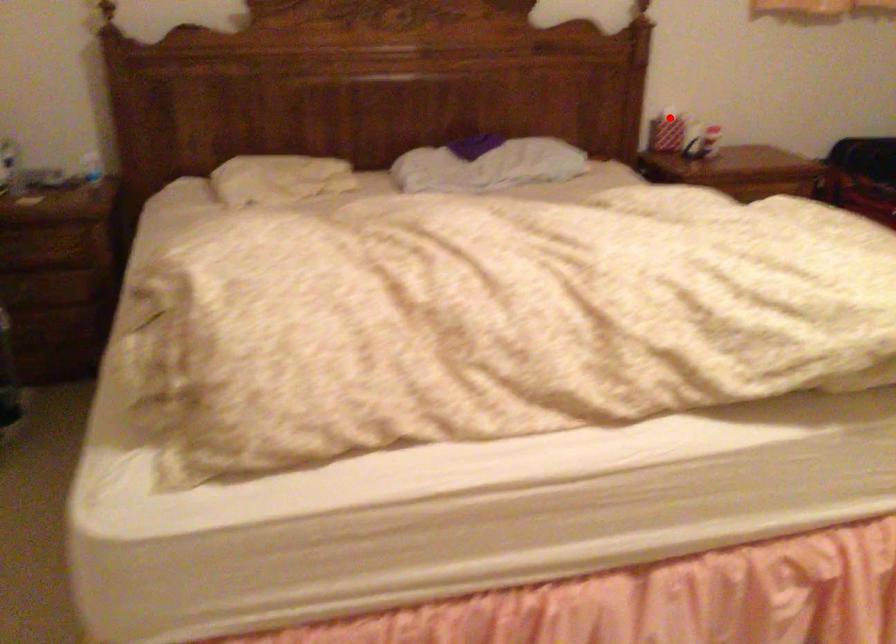
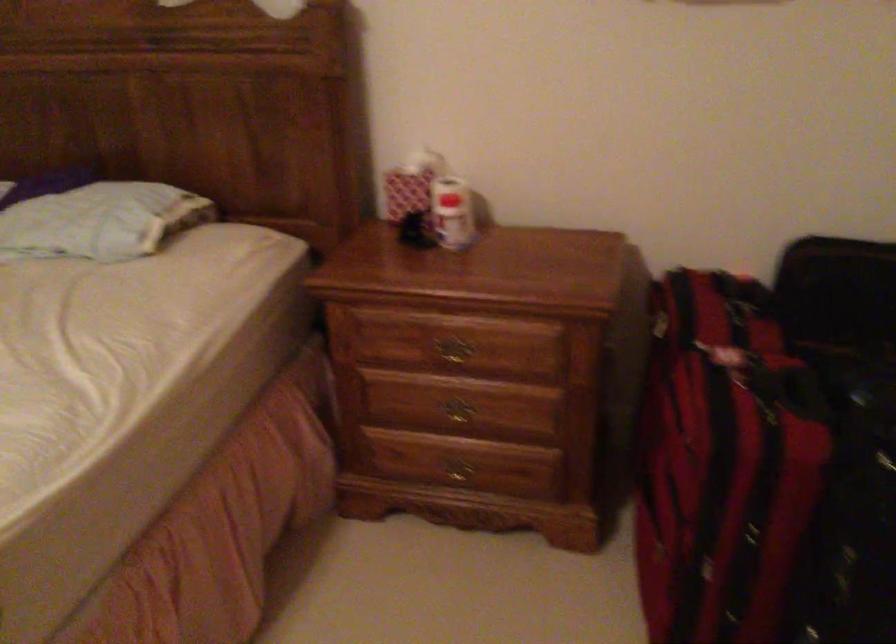
Where in the second image is the point corresponding to the highlighted location from the first image?

(410, 184)